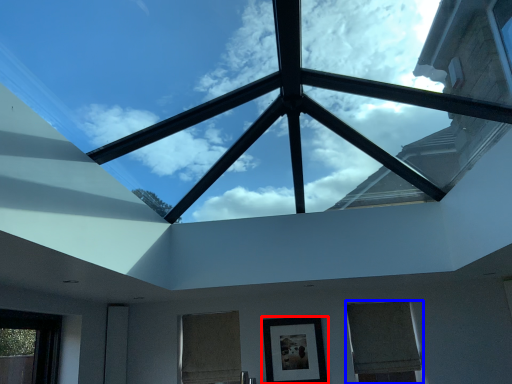
Question: Which object appears closest to the camera in this image, picture frame (highlighted by a red box) or window (highlighted by a blue box)?

Choices:
 (A) picture frame
 (B) window

Answer: (A)